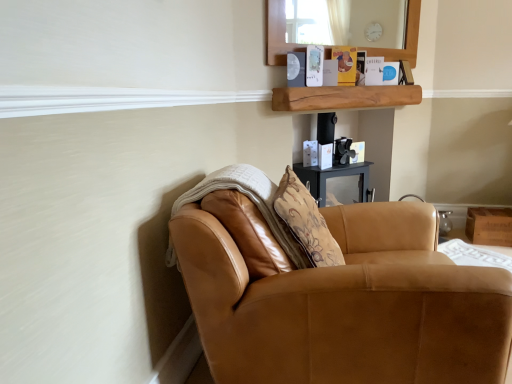
Question: Is natural wood shelf at upper center positioned with its back to saddle brown leather chair at lower right?

Choices:
 (A) no
 (B) yes

Answer: (A)

Question: From a real-world perspective, does natural wood shelf at upper center sit lower than saddle brown leather chair at lower right?

Choices:
 (A) yes
 (B) no

Answer: (B)

Question: Does natural wood shelf at upper center have a lesser height compared to saddle brown leather chair at lower right?

Choices:
 (A) yes
 (B) no

Answer: (A)

Question: Does natural wood shelf at upper center appear on the right side of saddle brown leather chair at lower right?

Choices:
 (A) no
 (B) yes

Answer: (B)

Question: Is natural wood shelf at upper center bigger than saddle brown leather chair at lower right?

Choices:
 (A) yes
 (B) no

Answer: (B)

Question: From their relative heights in the image, would you say saddle brown leather chair at lower right is taller or shorter than natural wood shelf at upper center?

Choices:
 (A) short
 (B) tall

Answer: (B)

Question: In the image, is saddle brown leather chair at lower right on the left side or the right side of natural wood shelf at upper center?

Choices:
 (A) left
 (B) right

Answer: (A)

Question: From a real-world perspective, is saddle brown leather chair at lower right positioned above or below natural wood shelf at upper center?

Choices:
 (A) below
 (B) above

Answer: (A)

Question: From the image's perspective, is saddle brown leather chair at lower right positioned above or below natural wood shelf at upper center?

Choices:
 (A) above
 (B) below

Answer: (B)

Question: Relative to wooden box at lower right, is natural wood shelf at upper center in front or behind?

Choices:
 (A) front
 (B) behind

Answer: (A)

Question: Is point (327, 97) closer or farther from the camera than point (495, 231)?

Choices:
 (A) closer
 (B) farther

Answer: (A)

Question: Is natural wood shelf at upper center situated inside wooden box at lower right or outside?

Choices:
 (A) outside
 (B) inside

Answer: (A)

Question: From a real-world perspective, is natural wood shelf at upper center above or below wooden box at lower right?

Choices:
 (A) above
 (B) below

Answer: (A)

Question: Based on their positions, is wooden box at lower right located to the left or right of saddle brown leather chair at lower right?

Choices:
 (A) left
 (B) right

Answer: (B)

Question: Considering the positions of wooden box at lower right and saddle brown leather chair at lower right in the image, is wooden box at lower right wider or thinner than saddle brown leather chair at lower right?

Choices:
 (A) wide
 (B) thin

Answer: (B)